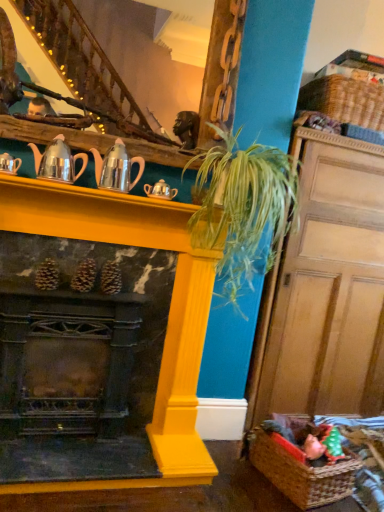
This screenshot has width=384, height=512. Describe the element at coordinates (301, 472) in the screenshot. I see `brown woven basket at lower right, arranged as the first basket when viewed from the front` at that location.

Measure the distance between woven brown basket at upper right, which is the 2th basket from bottom to top, and camera.

Answer: They are 7.29 feet apart.

What do you see at coordinates (116, 168) in the screenshot? I see `shiny metallic teapot at center, which is the 3th tea pot in left-to-right order` at bounding box center [116, 168].

Find the location of a particular element. The image size is (384, 512). green leafy plant at center is located at coordinates (242, 207).

From the image's perspective, would you say green leafy plant at center is positioned over shiny metallic teapot at center, which is the 3th tea pot in left-to-right order?

No, from the image's perspective, green leafy plant at center is not on top of shiny metallic teapot at center, which is the 3th tea pot in left-to-right order.

Who is taller, green leafy plant at center or shiny metallic teapot at center, which is the 3th tea pot in left-to-right order?

Standing taller between the two is green leafy plant at center.

Looking at this image, is green leafy plant at center not within shiny metallic teapot at center, which appears as the second tea pot when viewed from the right?

That's correct, green leafy plant at center is outside of shiny metallic teapot at center, which appears as the second tea pot when viewed from the right.

Is green leafy plant at center oriented away from shiny metallic teapot at center, which is the 3th tea pot in left-to-right order?

No, green leafy plant at center is not facing the opposite direction of shiny metallic teapot at center, which is the 3th tea pot in left-to-right order.

Is silver metallic teapot at center, the 1th tea pot positioned from the right, positioned with its back to shiny silver teapot at upper left, which is counted as the second tea pot, starting from the left?

No, silver metallic teapot at center, the 1th tea pot positioned from the right, is not facing away from shiny silver teapot at upper left, which is counted as the second tea pot, starting from the left.

From a real-world perspective, starting from the shiny silver teapot at upper left, which is counted as the second tea pot, starting from the left, which tea pot is the 1st one below it? Please provide its 2D coordinates.

[(160, 190)]

Looking at this image, can we say silver metallic teapot at center, which appears as the 4th tea pot when viewed from the left, lies outside shiny silver teapot at upper left, which is the 3th tea pot in right-to-left order?

silver metallic teapot at center, which appears as the 4th tea pot when viewed from the left, is positioned outside shiny silver teapot at upper left, which is the 3th tea pot in right-to-left order.

Which of these two, silver metallic teapot at center, the 1th tea pot positioned from the right, or shiny silver teapot at upper left, which is the 3th tea pot in right-to-left order, stands shorter?

silver metallic teapot at center, the 1th tea pot positioned from the right, is shorter.

From the picture: Considering the relative sizes of brown woven basket at lower right, which is the 2th basket in top-to-bottom order, and metallic silver teapot at upper left, which ranks as the 4th tea pot in right-to-left order, in the image provided, is brown woven basket at lower right, which is the 2th basket in top-to-bottom order, bigger than metallic silver teapot at upper left, which ranks as the 4th tea pot in right-to-left order,?

Correct, brown woven basket at lower right, which is the 2th basket in top-to-bottom order, is larger in size than metallic silver teapot at upper left, which ranks as the 4th tea pot in right-to-left order.

In order to click on basket directly beneath the metallic silver teapot at upper left, which ranks as the 4th tea pot in right-to-left order (from a real-world perspective) in this screenshot , I will do `click(301, 472)`.

From the picture: Does brown woven basket at lower right, positioned as the second basket in back-to-front order, have a lesser height compared to metallic silver teapot at upper left, acting as the 1th tea pot starting from the left?

In fact, brown woven basket at lower right, positioned as the second basket in back-to-front order, may be taller than metallic silver teapot at upper left, acting as the 1th tea pot starting from the left.

Is brown woven basket at lower right, which is counted as the 1th basket, starting from the bottom, turned away from metallic silver teapot at upper left, acting as the 1th tea pot starting from the left?

brown woven basket at lower right, which is counted as the 1th basket, starting from the bottom, is not turned away from metallic silver teapot at upper left, acting as the 1th tea pot starting from the left.

Is woven brown basket at upper right, marked as the second basket in a front-to-back arrangement, not near brown woven basket at lower right, arranged as the first basket when viewed from the front?

That's right, there is a large distance between woven brown basket at upper right, marked as the second basket in a front-to-back arrangement, and brown woven basket at lower right, arranged as the first basket when viewed from the front.

Considering the positions of points (380, 129) and (249, 446), is point (380, 129) closer to camera compared to point (249, 446)?

No, it is behind (249, 446).

Does woven brown basket at upper right, the 1th basket when ordered from back to front, lie behind brown woven basket at lower right, which is the 2th basket in top-to-bottom order?

Yes, it is behind brown woven basket at lower right, which is the 2th basket in top-to-bottom order.

Is woven brown basket at upper right, which is the 2th basket from bottom to top, looking in the opposite direction of brown woven basket at lower right, positioned as the second basket in back-to-front order?

woven brown basket at upper right, which is the 2th basket from bottom to top, is not turned away from brown woven basket at lower right, positioned as the second basket in back-to-front order.

Looking at this image, does silver metallic teapot at center, which appears as the 4th tea pot when viewed from the left, have a greater width compared to shiny metallic teapot at center, which appears as the second tea pot when viewed from the right?

No.

From a real-world perspective, who is located higher, silver metallic teapot at center, the 1th tea pot positioned from the right, or shiny metallic teapot at center, which is the 3th tea pot in left-to-right order?

From a 3D spatial view, shiny metallic teapot at center, which is the 3th tea pot in left-to-right order, is above.

Does silver metallic teapot at center, the 1th tea pot positioned from the right, have a larger size compared to shiny metallic teapot at center, which is the 3th tea pot in left-to-right order?

Actually, silver metallic teapot at center, the 1th tea pot positioned from the right, might be smaller than shiny metallic teapot at center, which is the 3th tea pot in left-to-right order.

Where is `the 1st tea pot in front of the silver metallic teapot at center, the 1th tea pot positioned from the right, counting from the anchor's position`? This screenshot has width=384, height=512. the 1st tea pot in front of the silver metallic teapot at center, the 1th tea pot positioned from the right, counting from the anchor's position is located at coordinates (116, 168).

Is shiny metallic teapot at center, which appears as the second tea pot when viewed from the right, far from yellow painted wood fireplace at center?

shiny metallic teapot at center, which appears as the second tea pot when viewed from the right, is near yellow painted wood fireplace at center, not far away.

From the image's perspective, which is below, shiny metallic teapot at center, which is the 3th tea pot in left-to-right order, or yellow painted wood fireplace at center?

yellow painted wood fireplace at center.

Is shiny metallic teapot at center, which is the 3th tea pot in left-to-right order, surrounding yellow painted wood fireplace at center?

No, shiny metallic teapot at center, which is the 3th tea pot in left-to-right order, does not contain yellow painted wood fireplace at center.

Considering the sizes of objects shiny metallic teapot at center, which appears as the second tea pot when viewed from the right, and yellow painted wood fireplace at center in the image provided, who is thinner, shiny metallic teapot at center, which appears as the second tea pot when viewed from the right, or yellow painted wood fireplace at center?

shiny metallic teapot at center, which appears as the second tea pot when viewed from the right, is thinner.

The width and height of the screenshot is (384, 512). I want to click on the 1st basket to the right of the silver metallic teapot at center, which appears as the 4th tea pot when viewed from the left, starting your count from the anchor, so click(x=301, y=472).

Measure the distance from brown woven basket at lower right, arranged as the first basket when viewed from the front, to silver metallic teapot at center, which appears as the 4th tea pot when viewed from the left.

brown woven basket at lower right, arranged as the first basket when viewed from the front, is 1.34 meters from silver metallic teapot at center, which appears as the 4th tea pot when viewed from the left.

From the picture: From a real-world perspective, is brown woven basket at lower right, which is counted as the 1th basket, starting from the bottom, beneath silver metallic teapot at center, the 1th tea pot positioned from the right?

Correct, in the physical world, brown woven basket at lower right, which is counted as the 1th basket, starting from the bottom, is lower than silver metallic teapot at center, the 1th tea pot positioned from the right.

Between brown woven basket at lower right, which is the 2th basket in top-to-bottom order, and silver metallic teapot at center, which appears as the 4th tea pot when viewed from the left, which one has less height?

silver metallic teapot at center, which appears as the 4th tea pot when viewed from the left.

Which tea pot is the 3rd one when counting from the back of the green leafy plant at center? Please provide its 2D coordinates.

[(116, 168)]

Where is `the 2nd tea pot counting from the right side of the shiny silver teapot at upper left, which is counted as the second tea pot, starting from the left`? The width and height of the screenshot is (384, 512). the 2nd tea pot counting from the right side of the shiny silver teapot at upper left, which is counted as the second tea pot, starting from the left is located at coordinates (160, 190).

Based on their spatial positions, is yellow painted wood fireplace at center or brown woven basket at lower right, which is the 2th basket in top-to-bottom order, closer to metallic silver teapot at upper left, which ranks as the 4th tea pot in right-to-left order?

The object closer to metallic silver teapot at upper left, which ranks as the 4th tea pot in right-to-left order, is yellow painted wood fireplace at center.

From the picture: Estimate the real-world distances between objects in this image. Which object is further from green leafy plant at center, metallic silver teapot at upper left, which ranks as the 4th tea pot in right-to-left order, or shiny metallic teapot at center, which appears as the second tea pot when viewed from the right?

metallic silver teapot at upper left, which ranks as the 4th tea pot in right-to-left order.

Based on the photo, when comparing their distances from silver metallic teapot at center, the 1th tea pot positioned from the right, does wooden door at right or shiny metallic teapot at center, which is the 3th tea pot in left-to-right order, seem closer?

shiny metallic teapot at center, which is the 3th tea pot in left-to-right order.

Which object lies further to the anchor point brown woven basket at lower right, which is the 2th basket in top-to-bottom order, woven brown basket at upper right, the 1th basket when ordered from back to front, or wooden door at right?

The object further to brown woven basket at lower right, which is the 2th basket in top-to-bottom order, is woven brown basket at upper right, the 1th basket when ordered from back to front.

Looking at the image, which one is located further to yellow painted wood fireplace at center, woven brown basket at upper right, which is the 2th basket from bottom to top, or wooden door at right?

Based on the image, woven brown basket at upper right, which is the 2th basket from bottom to top, appears to be further to yellow painted wood fireplace at center.

Considering their positions, is metallic silver teapot at upper left, which ranks as the 4th tea pot in right-to-left order, positioned closer to yellow painted wood fireplace at center than wooden door at right?

metallic silver teapot at upper left, which ranks as the 4th tea pot in right-to-left order, is closer to yellow painted wood fireplace at center.

Looking at the image, which one is located closer to brown woven basket at lower right, arranged as the first basket when viewed from the front, green leafy plant at center or woven brown basket at upper right, which is the 2th basket from bottom to top?

green leafy plant at center lies closer to brown woven basket at lower right, arranged as the first basket when viewed from the front, than the other object.

Which object lies further to the anchor point silver metallic teapot at center, which appears as the 4th tea pot when viewed from the left, yellow painted wood fireplace at center or wooden door at right?

wooden door at right lies further to silver metallic teapot at center, which appears as the 4th tea pot when viewed from the left, than the other object.

Image resolution: width=384 pixels, height=512 pixels. Find the location of `plant located between wooden staircase at upper center and woven brown basket at upper right, which is the 2th basket from bottom to top, in the left-right direction`. plant located between wooden staircase at upper center and woven brown basket at upper right, which is the 2th basket from bottom to top, in the left-right direction is located at coordinates (242, 207).

At what (x,y) coordinates should I click in order to perform the action: click on fireplace that lies between green leafy plant at center and brown woven basket at lower right, arranged as the first basket when viewed from the front, from top to bottom. Please return your answer as a coordinate pair (x, y). The height and width of the screenshot is (512, 384). Looking at the image, I should click on click(168, 315).

This screenshot has height=512, width=384. Find the location of `fireplace that lies between silver metallic teapot at center, which appears as the 4th tea pot when viewed from the left, and brown woven basket at lower right, positioned as the second basket in back-to-front order, from top to bottom`. fireplace that lies between silver metallic teapot at center, which appears as the 4th tea pot when viewed from the left, and brown woven basket at lower right, positioned as the second basket in back-to-front order, from top to bottom is located at coordinates (168, 315).

Identify the location of stairwell between metallic silver teapot at upper left, which ranks as the 4th tea pot in right-to-left order, and woven brown basket at upper right, which appears as the first basket when viewed from the top, from left to right. (84, 63).